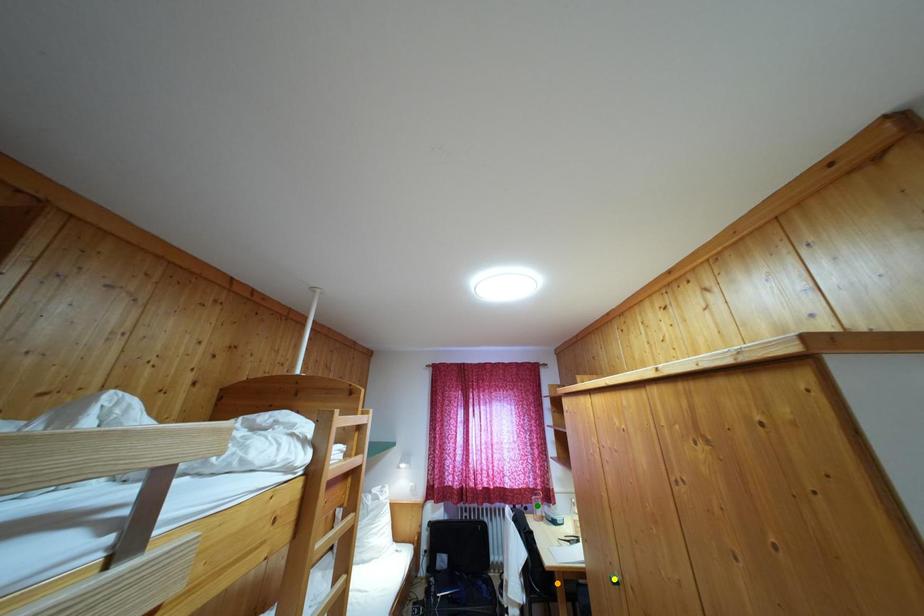
Order these from nearest to farthest:
1. orange point
2. yellow point
3. green point

yellow point, orange point, green point